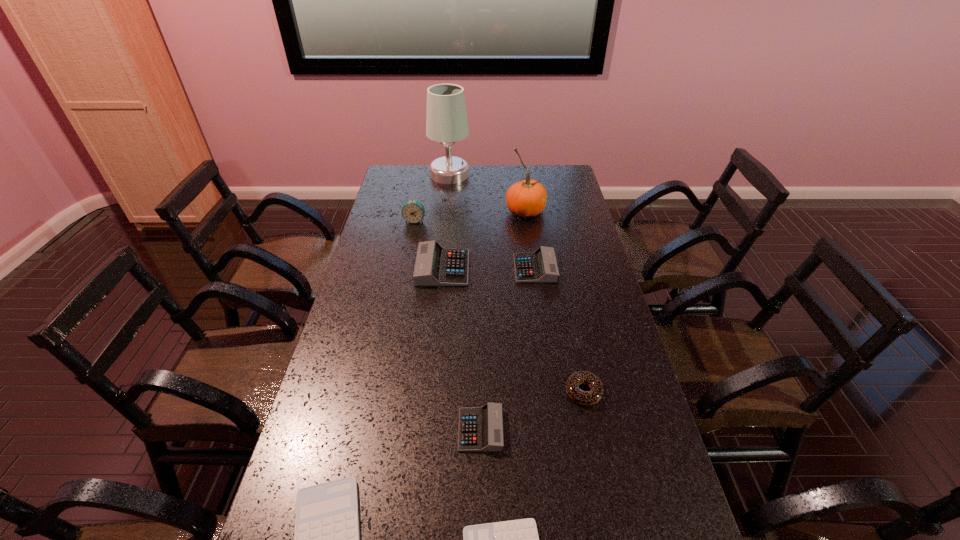
Find the location of a particular element. free space located on the front of the smallest gray calculator is located at coordinates (481, 528).

The image size is (960, 540). What are the coordinates of `object that is at the far edge` in the screenshot? It's located at (446, 119).

Image resolution: width=960 pixels, height=540 pixels. I want to click on object that is at the left edge, so click(x=413, y=211).

At what (x,y) coordinates should I click in order to perform the action: click on pumpkin situated at the right edge. Please return your answer as a coordinate pair (x, y). Looking at the image, I should click on (527, 198).

I want to click on doughnut situated at the right edge, so click(591, 397).

Find the location of `blank space at the far edge`. blank space at the far edge is located at coordinates (517, 181).

Find the location of a particular element. Image resolution: width=960 pixels, height=540 pixels. vacant position at the left edge of the desktop is located at coordinates (379, 286).

In the image, there is a desktop. Where is `vacant space at the right edge`? vacant space at the right edge is located at coordinates (575, 324).

In the image, there is a desktop. Identify the location of vacant space at the far left corner. (400, 178).

I want to click on vacant area that lies between the pumpkin and the blue alarm clock, so click(x=470, y=216).